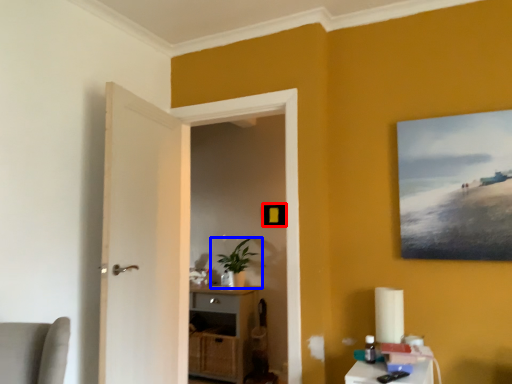
Question: Which of the following is the closest to the observer, picture frame (highlighted by a red box) or houseplant (highlighted by a blue box)?

Choices:
 (A) picture frame
 (B) houseplant

Answer: (B)